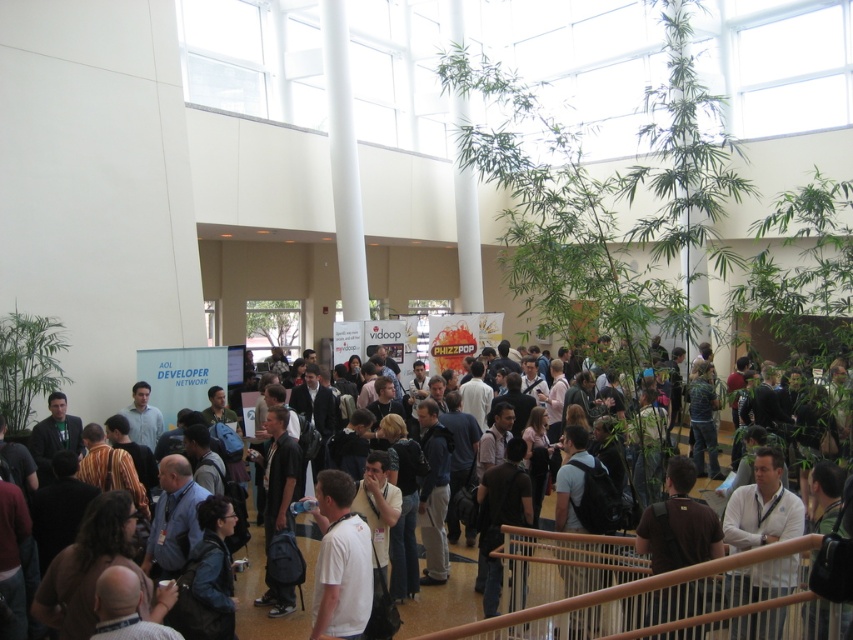
Does dark blue shirt at center appear under white matte shirt at center?

Correct, dark blue shirt at center is located below white matte shirt at center.

Does dark blue shirt at center have a lesser height compared to white matte shirt at center?

Correct, dark blue shirt at center is not as tall as white matte shirt at center.

What do you see at coordinates (674, 602) in the screenshot? I see `dark blue shirt at center` at bounding box center [674, 602].

Where is `dark blue shirt at center`? dark blue shirt at center is located at coordinates (674, 602).

Is point (654, 525) positioned behind point (320, 605)?

Yes, it is behind point (320, 605).

Is brown fabric backpack at lower center below white matte shirt at center?

Actually, brown fabric backpack at lower center is above white matte shirt at center.

Measure the distance between brown fabric backpack at lower center and camera.

brown fabric backpack at lower center and camera are 17.72 feet apart from each other.

Where is `brown fabric backpack at lower center`? This screenshot has width=853, height=640. brown fabric backpack at lower center is located at coordinates (677, 524).

In the scene shown: How far apart are dark blue shirt at center and white matte shirt at lower right?

They are 4.54 feet apart.

In the scene shown: How much distance is there between dark blue shirt at center and white matte shirt at lower right?

dark blue shirt at center is 1.38 meters from white matte shirt at lower right.

Does point (624, 586) lie in front of point (763, 506)?

That is True.

Locate an element on the screen. The image size is (853, 640). dark blue shirt at center is located at coordinates [674, 602].